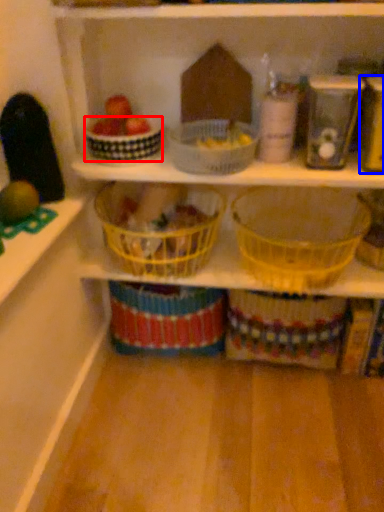
Question: Which of the following is the farthest to the observer, basket (highlighted by a red box) or appliance (highlighted by a blue box)?

Choices:
 (A) basket
 (B) appliance

Answer: (A)